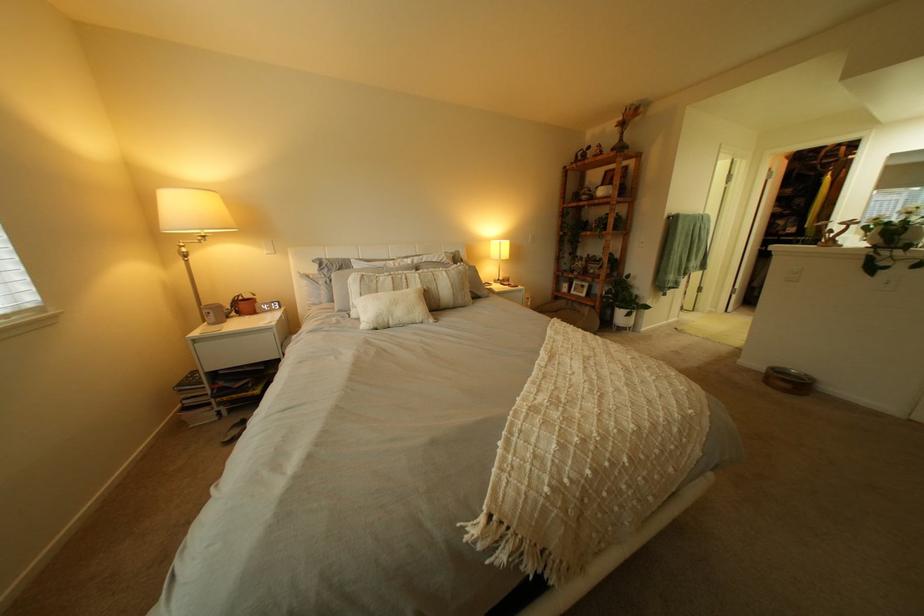
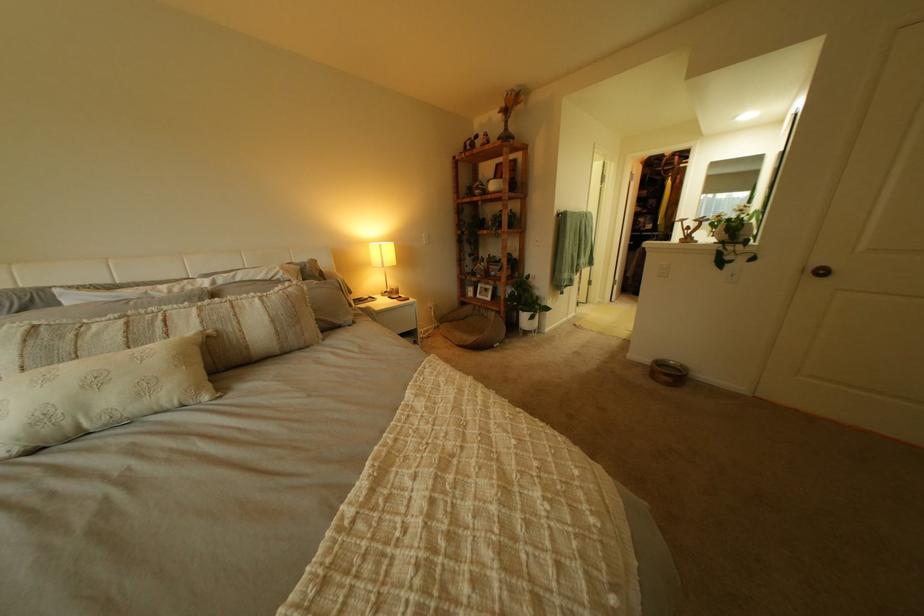
In the second image, find the point that corresponds to [505,241] in the first image.

(381, 244)